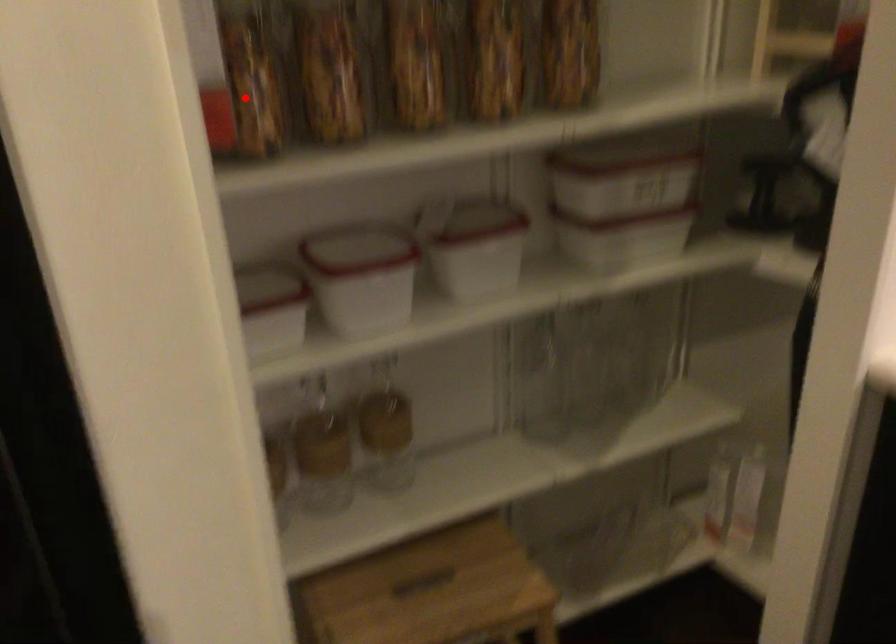
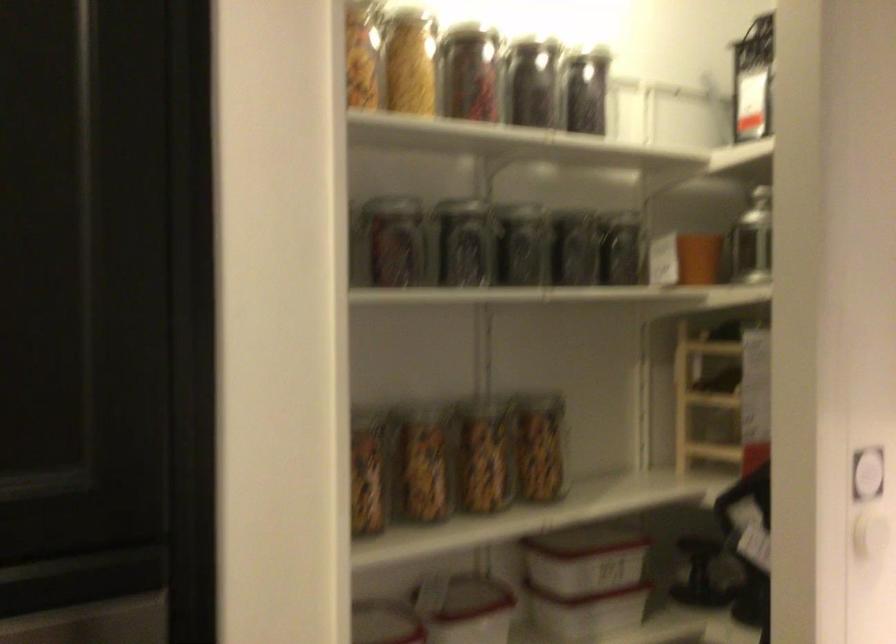
Question: I am providing you with two images of the same scene from different viewpoints. A red point is marked on the first image. Can you still see the location of the red point in image 2?

Choices:
 (A) Yes
 (B) No

Answer: (B)